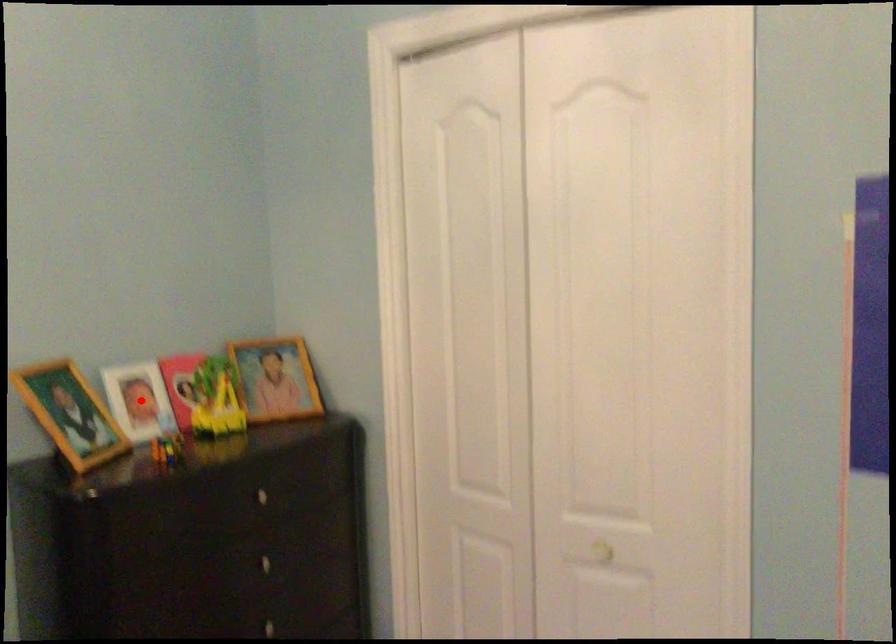
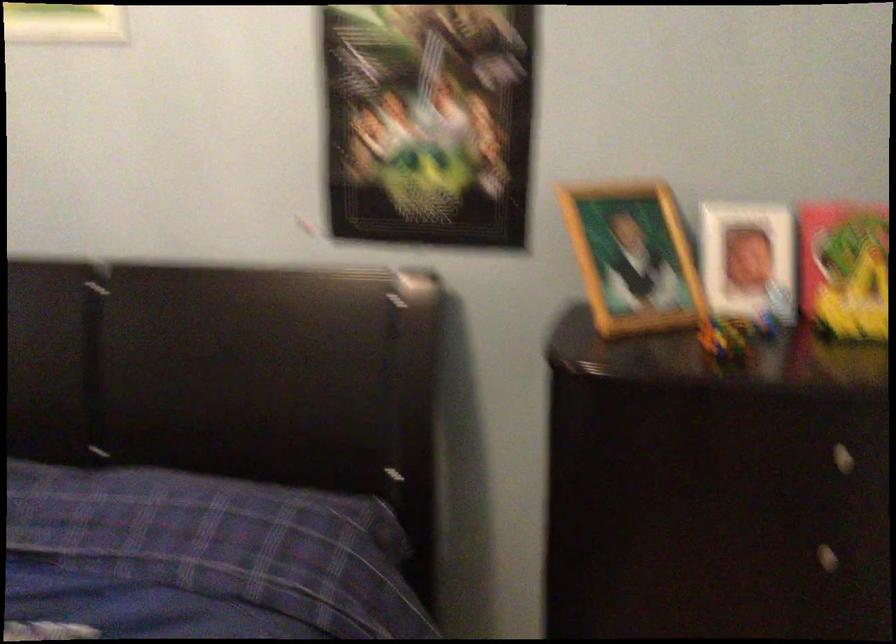
In the second image, find the point that corresponds to the highlighted location in the first image.

(748, 261)